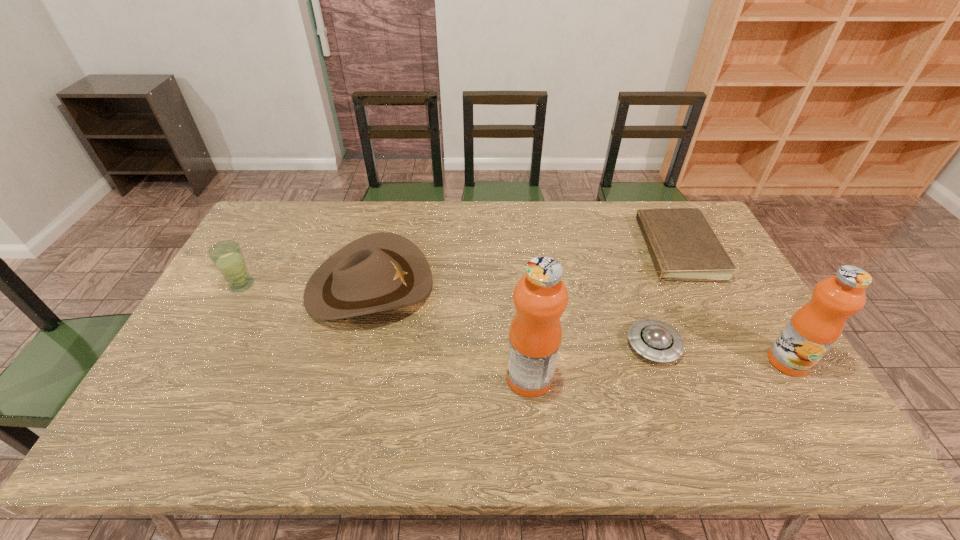
All fruit juices are currently evenly spaced. To continue this pattern, where would you add another fruit juice on the left? Please point out a vacant spot. Please provide its 2D coordinates. Your answer should be formatted as a tuple, i.e. [(x, y)], where the tuple contains the x and y coordinates of a point satisfying the conditions above.

[(254, 394)]